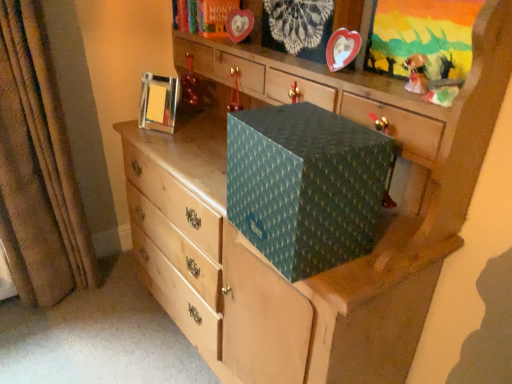
Question: In terms of size, does metallic silver picture frame at upper left, the 1th picture frame positioned from the left, appear bigger or smaller than teal textured box at center?

Choices:
 (A) small
 (B) big

Answer: (A)

Question: Which is correct: metallic silver picture frame at upper left, which is the first picture frame in back-to-front order, is inside teal textured box at center, or outside of it?

Choices:
 (A) inside
 (B) outside

Answer: (B)

Question: Which object is positioned farthest from the teal textured box at center?

Choices:
 (A) brown textured curtain at left
 (B) metallic red ornament at upper center, which is the 2th toy from right to left
 (C) shiny gold figurine at upper right, the 1th toy in the bottom-to-top sequence
 (D) metallic silver picture frame at upper left, which is counted as the second picture frame, starting from the front
 (E) metallic heart-shaped frame at upper center, positioned as the second picture frame in back-to-front order

Answer: (A)

Question: Which object is positioned closest to the shiny gold figurine at upper right, the 2th toy positioned from the left?

Choices:
 (A) metallic heart-shaped frame at upper center, the first picture frame viewed from the right
 (B) metallic silver picture frame at upper left, the 1th picture frame positioned from the left
 (C) metallic red ornament at upper center, placed as the first toy when sorted from back to front
 (D) teal textured box at center
 (E) brown textured curtain at left

Answer: (A)